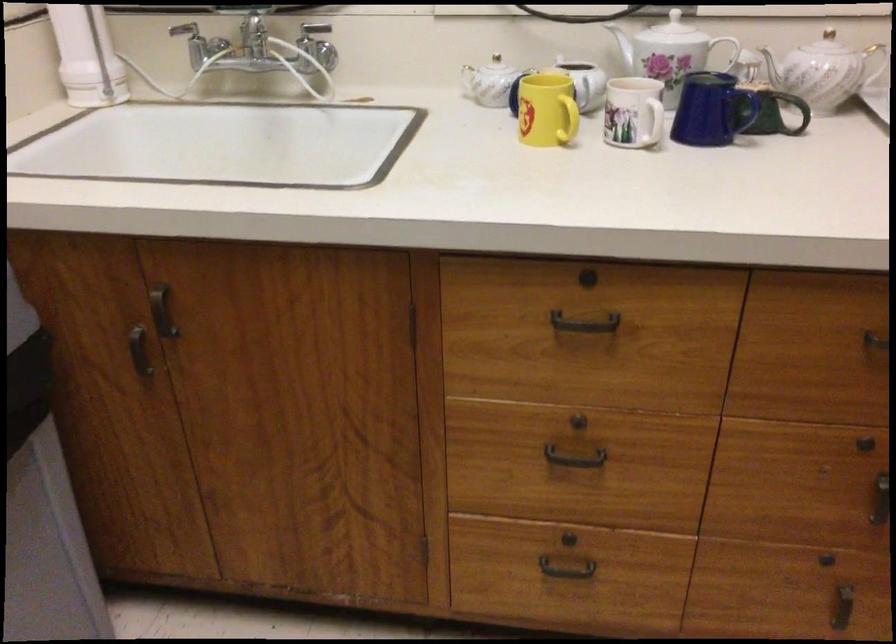
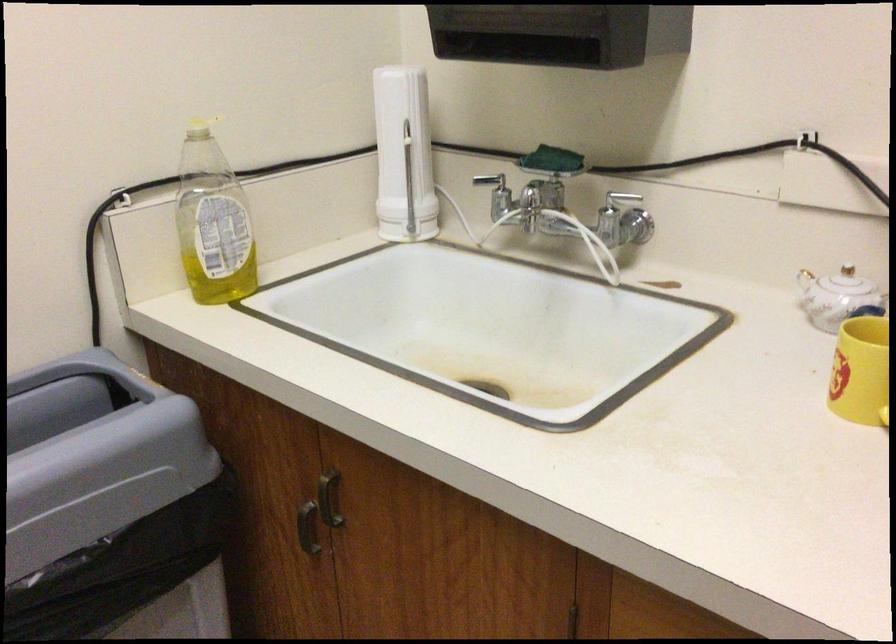
Where in the second image is the point corresponding to (160,315) from the first image?

(328, 498)